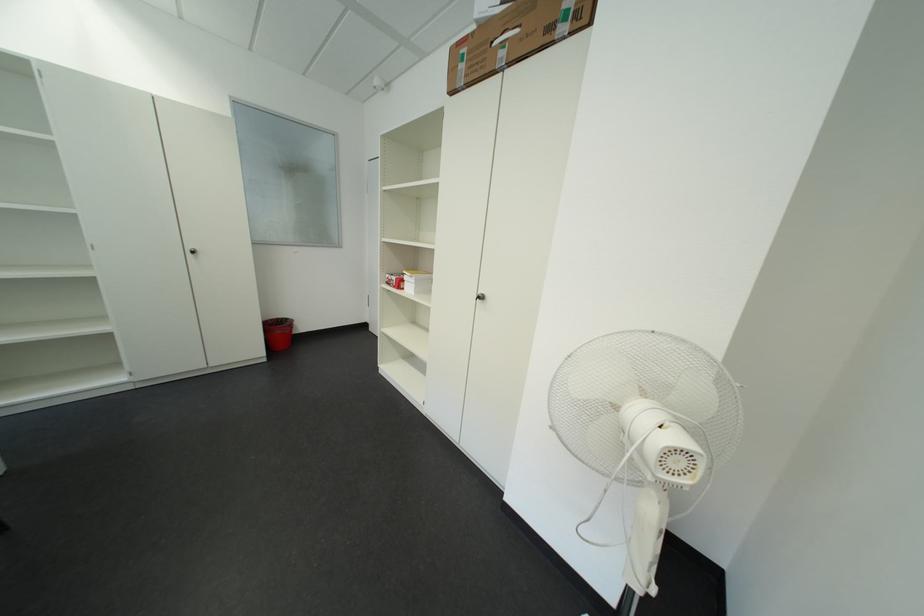
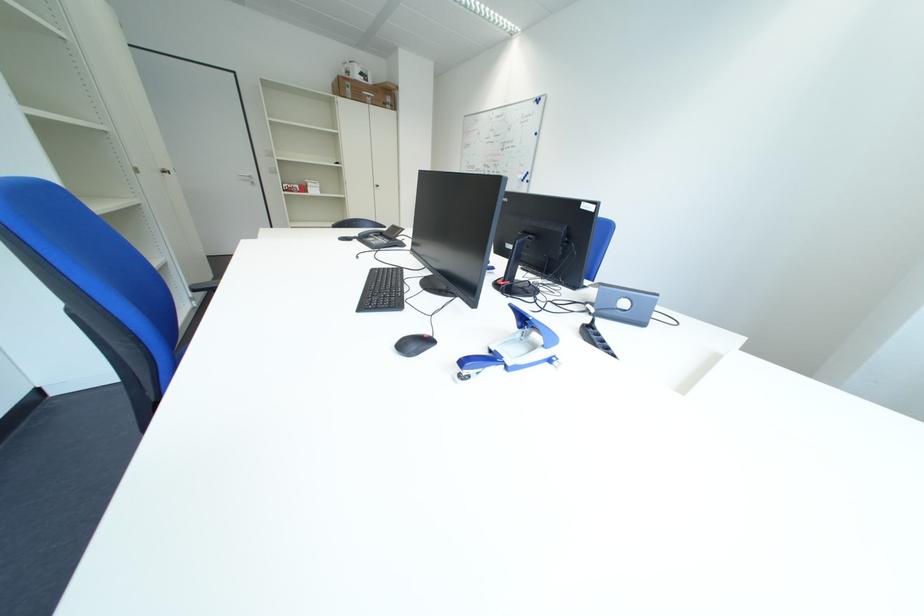
Find the pixel in the second image that matches (475,70) in the first image.

(360, 92)